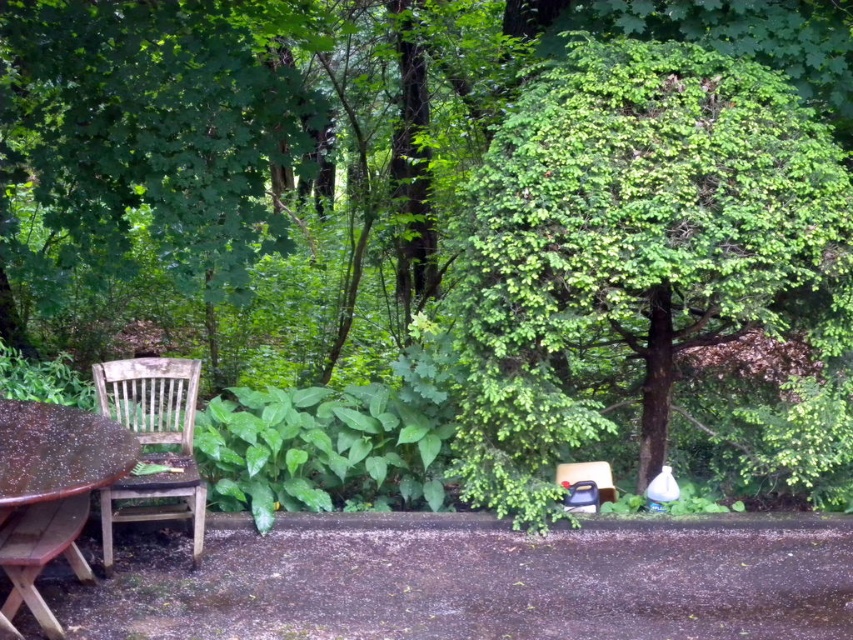
Question: Does wooden picnic table at lower left have a larger size compared to worn wood chair at left?

Choices:
 (A) no
 (B) yes

Answer: (A)

Question: Which object is farther from the camera taking this photo?

Choices:
 (A) wooden picnic table at lower left
 (B) worn wood chair at left
 (C) green leafy tree at center

Answer: (C)

Question: Among these objects, which one is nearest to the camera?

Choices:
 (A) green leafy tree at center
 (B) wooden picnic table at lower left
 (C) worn wood chair at left

Answer: (B)

Question: Does green leafy tree at center appear over wooden picnic table at lower left?

Choices:
 (A) no
 (B) yes

Answer: (B)

Question: Can you confirm if green leafy tree at center is smaller than wooden picnic table at lower left?

Choices:
 (A) no
 (B) yes

Answer: (A)

Question: Which object is the farthest from the worn wood chair at left?

Choices:
 (A) wooden picnic table at lower left
 (B) green leafy tree at center

Answer: (B)